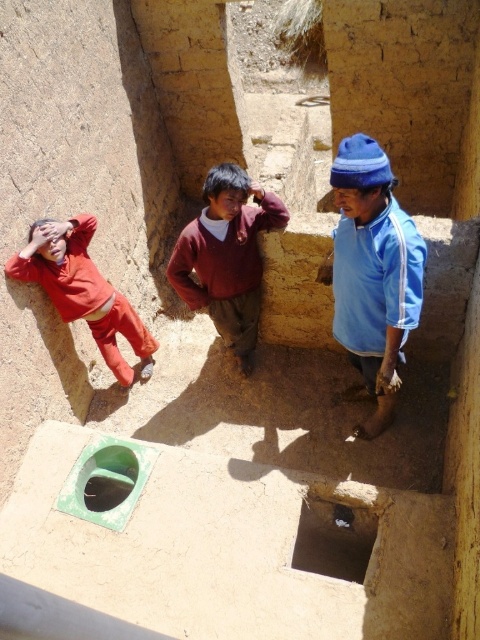
Question: Can you confirm if maroon sweater at center is positioned to the right of matte red pants at left?

Choices:
 (A) no
 (B) yes

Answer: (B)

Question: Estimate the real-world distances between objects in this image. Which object is closer to the blue fabric shirt at right?

Choices:
 (A) maroon sweater at center
 (B) matte red pants at left

Answer: (A)

Question: Based on their relative distances, which object is farther from the maroon sweater at center?

Choices:
 (A) matte red pants at left
 (B) blue fabric shirt at right

Answer: (B)

Question: Considering the real-world distances, which object is farthest from the maroon sweater at center?

Choices:
 (A) matte red pants at left
 (B) blue fabric shirt at right

Answer: (B)

Question: Where is maroon sweater at center located in relation to matte red pants at left in the image?

Choices:
 (A) right
 (B) left

Answer: (A)

Question: Can you confirm if blue fabric shirt at right is wider than matte red pants at left?

Choices:
 (A) yes
 (B) no

Answer: (B)